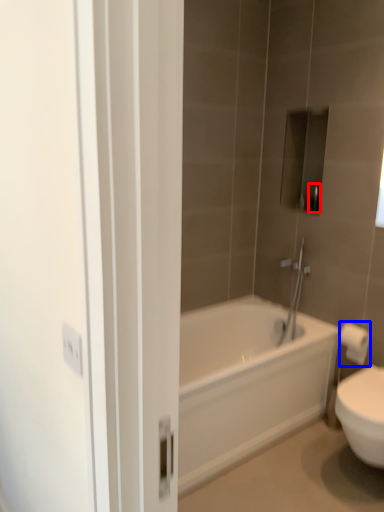
Question: Which of the following is the closest to the observer, toiletry (highlighted by a red box) or toilet paper (highlighted by a blue box)?

Choices:
 (A) toiletry
 (B) toilet paper

Answer: (B)